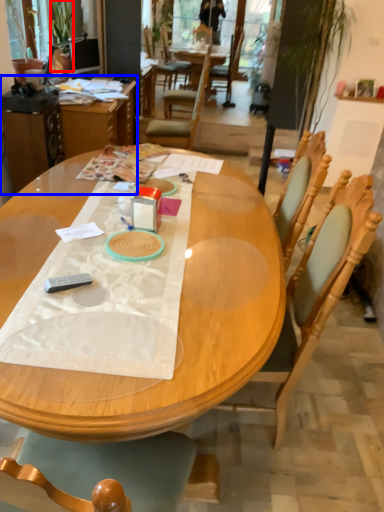
Question: Which object appears closest to the camera in this image, houseplant (highlighted by a red box) or table (highlighted by a blue box)?

Choices:
 (A) houseplant
 (B) table

Answer: (B)